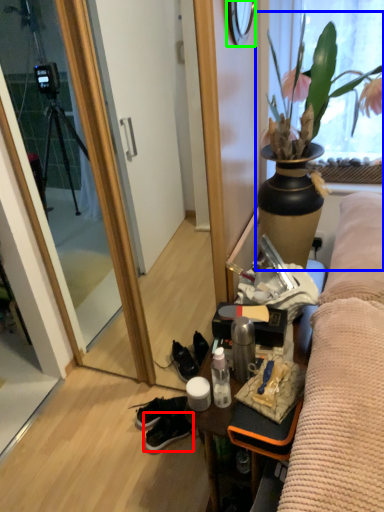
Question: Which object is the closest to the sneakers (highlighted by a red box)? Choose among these: houseplant (highlighted by a blue box) or mirror (highlighted by a green box).

Choices:
 (A) houseplant
 (B) mirror

Answer: (A)